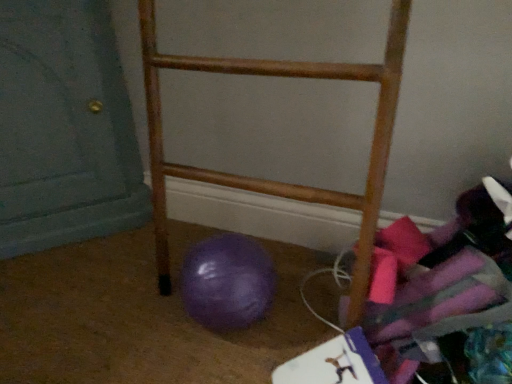
At what (x,y) coordinates should I click in order to perform the action: click on free space between matte teal door at lower left and wooden rack at center. Please return your answer as a coordinate pair (x, y). Image resolution: width=512 pixels, height=384 pixels. Looking at the image, I should click on (139, 285).